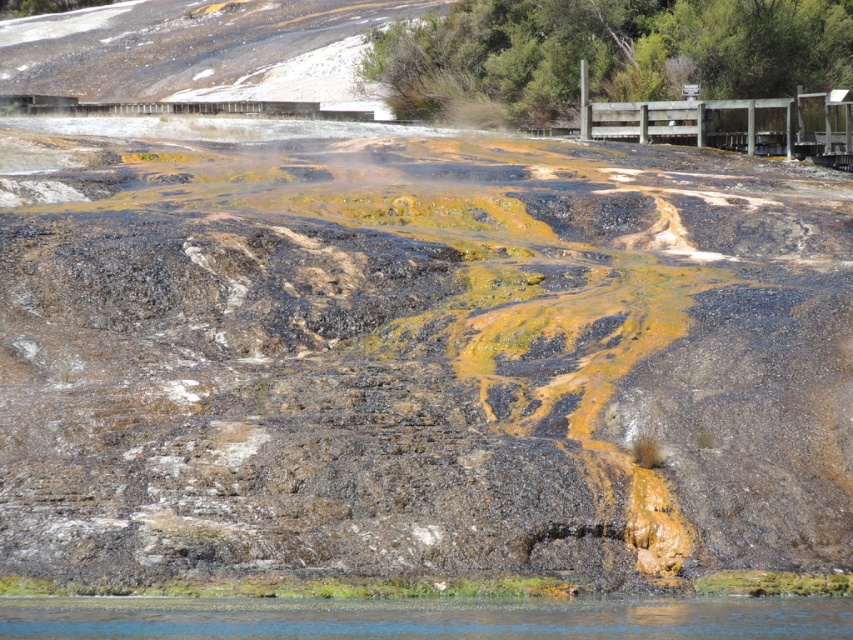
Question: Which object is closer to the camera taking this photo?

Choices:
 (A) clear water at lower center
 (B) rusty metal bridge at upper left

Answer: (A)

Question: Is rusty metal bridge at upper left to the right of clear water at lower center from the viewer's perspective?

Choices:
 (A) no
 (B) yes

Answer: (A)

Question: Which of the following is the farthest from the observer?

Choices:
 (A) rusty metal bridge at upper left
 (B) clear water at lower center

Answer: (A)

Question: Is rusty metal bridge at upper left in front of clear water at lower center?

Choices:
 (A) no
 (B) yes

Answer: (A)

Question: Observing the image, what is the correct spatial positioning of rusty metal bridge at upper left in reference to clear water at lower center?

Choices:
 (A) below
 (B) above

Answer: (B)